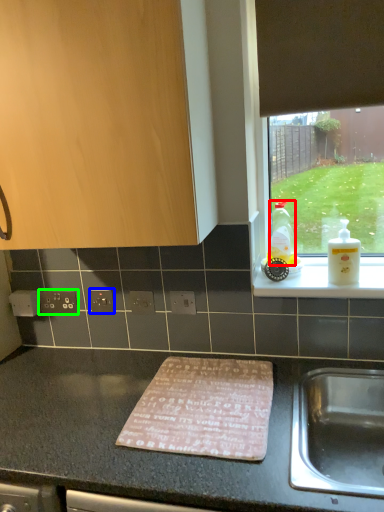
Question: Which is farther away from bottle (highlighted by a red box)? electric outlet (highlighted by a blue box) or electric outlet (highlighted by a green box)?

Choices:
 (A) electric outlet
 (B) electric outlet

Answer: (B)